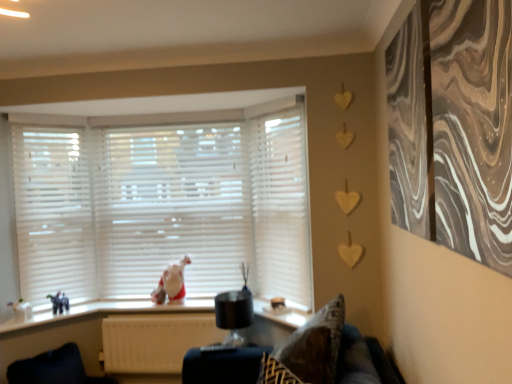
Question: Should I look upward or downward to see white plastic window sill at lower center?

Choices:
 (A) down
 (B) up

Answer: (A)

Question: Is white matte blinds at left bigger than white glossy chicken at center?

Choices:
 (A) no
 (B) yes

Answer: (B)

Question: From a real-world perspective, is white matte blinds at left positioned over white glossy chicken at center based on gravity?

Choices:
 (A) no
 (B) yes

Answer: (B)

Question: Is white matte blinds at left surrounding white glossy chicken at center?

Choices:
 (A) no
 (B) yes

Answer: (A)

Question: Is white matte blinds at left positioned with its back to white glossy chicken at center?

Choices:
 (A) yes
 (B) no

Answer: (B)

Question: Does white matte blinds at left come behind white glossy chicken at center?

Choices:
 (A) no
 (B) yes

Answer: (A)

Question: Could you tell me if white matte blinds at left is turned towards white glossy chicken at center?

Choices:
 (A) yes
 (B) no

Answer: (B)

Question: Can you confirm if white matte blinds at center, acting as the 1th curtain starting from the back, is thinner than white matte blinds at center?

Choices:
 (A) yes
 (B) no

Answer: (A)

Question: Does white matte blinds at center, the second curtain positioned from the right, lie in front of white matte blinds at center?

Choices:
 (A) yes
 (B) no

Answer: (A)

Question: From a real-world perspective, is white matte blinds at center, the second curtain viewed from the front, below white matte blinds at center?

Choices:
 (A) yes
 (B) no

Answer: (A)

Question: From a real-world perspective, is white matte blinds at center, the second curtain positioned from the right, positioned over white matte blinds at center based on gravity?

Choices:
 (A) no
 (B) yes

Answer: (A)

Question: Does white matte blinds at center, the first curtain in the left-to-right sequence, have a greater width compared to white matte blinds at center?

Choices:
 (A) yes
 (B) no

Answer: (B)

Question: From a real-world perspective, is velvet dark blue swivel chair at lower left positioned under white matte blinds at center based on gravity?

Choices:
 (A) no
 (B) yes

Answer: (B)